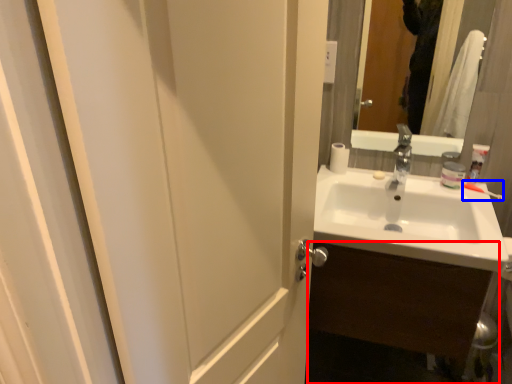
Question: Among these objects, which one is farthest to the camera, bathroom cabinet (highlighted by a red box) or toothbrush (highlighted by a blue box)?

Choices:
 (A) bathroom cabinet
 (B) toothbrush

Answer: (B)